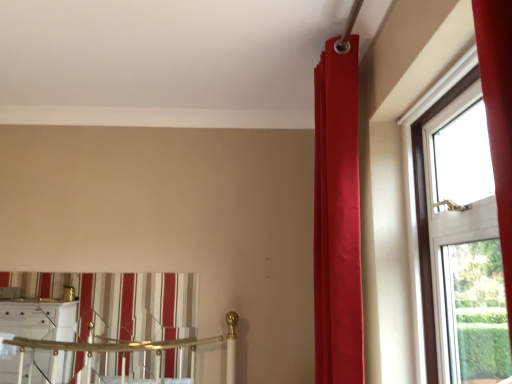
Question: Can you confirm if satin red curtain at upper right, the first curtain from the front, is thinner than transparent glass window at right?

Choices:
 (A) yes
 (B) no

Answer: (B)

Question: From the image's perspective, is satin red curtain at upper right, which ranks as the first curtain in right-to-left order, below transparent glass window at right?

Choices:
 (A) yes
 (B) no

Answer: (B)

Question: Is satin red curtain at upper right, the first curtain from the front, behind transparent glass window at right?

Choices:
 (A) yes
 (B) no

Answer: (A)

Question: Does satin red curtain at upper right, marked as the second curtain in a back-to-front arrangement, turn towards transparent glass window at right?

Choices:
 (A) yes
 (B) no

Answer: (B)

Question: Is satin red curtain at upper right, which ranks as the first curtain in right-to-left order, not near transparent glass window at right?

Choices:
 (A) no
 (B) yes

Answer: (A)

Question: Could transparent glass window at right be considered to be inside satin red curtain at upper right, marked as the 2th curtain in a left-to-right arrangement?

Choices:
 (A) no
 (B) yes

Answer: (A)

Question: Is transparent glass window at right closer to camera compared to satin red curtain at upper right, marked as the 2th curtain in a left-to-right arrangement?

Choices:
 (A) no
 (B) yes

Answer: (B)

Question: Can you confirm if transparent glass window at right is taller than satin red curtain at upper right, marked as the second curtain in a back-to-front arrangement?

Choices:
 (A) no
 (B) yes

Answer: (A)

Question: Does transparent glass window at right have a lesser height compared to satin red curtain at upper right, the first curtain from the front?

Choices:
 (A) no
 (B) yes

Answer: (B)

Question: Does transparent glass window at right have a lesser width compared to satin red curtain at upper right, marked as the second curtain in a back-to-front arrangement?

Choices:
 (A) no
 (B) yes

Answer: (B)

Question: From the image's perspective, is transparent glass window at right located above satin red curtain at upper right, marked as the second curtain in a back-to-front arrangement?

Choices:
 (A) yes
 (B) no

Answer: (B)

Question: Is transparent glass window at right at the left side of satin red curtain at upper right, marked as the second curtain in a back-to-front arrangement?

Choices:
 (A) yes
 (B) no

Answer: (B)

Question: Is satin red curtain at upper right, the first curtain from the front, positioned in front of striped fabric curtain at lower left, the second curtain viewed from the front?

Choices:
 (A) yes
 (B) no

Answer: (A)